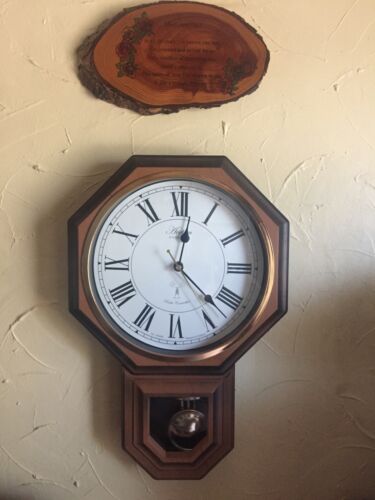
Where is `clock hand`? This screenshot has width=375, height=500. clock hand is located at coordinates (192, 427).